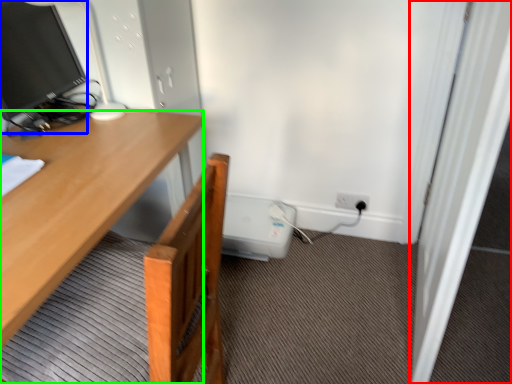
Question: Based on their relative distances, which object is farther from screen door (highlighted by a red box)? Choose from television (highlighted by a blue box) and desk (highlighted by a green box).

Choices:
 (A) television
 (B) desk

Answer: (A)